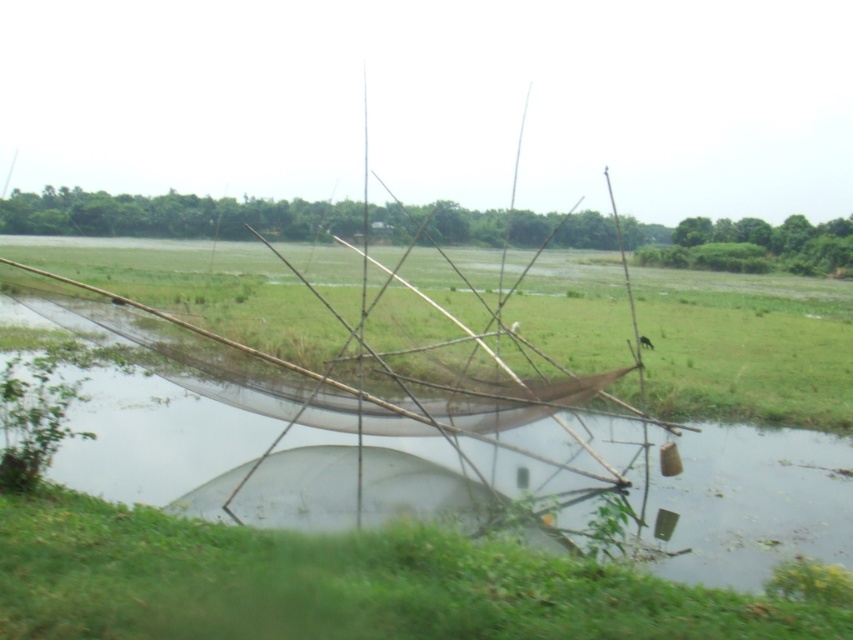
Can you confirm if green grass at lower left is taller than green grass at center?

No, green grass at lower left is not taller than green grass at center.

Find the location of a particular element. green grass at lower left is located at coordinates (337, 582).